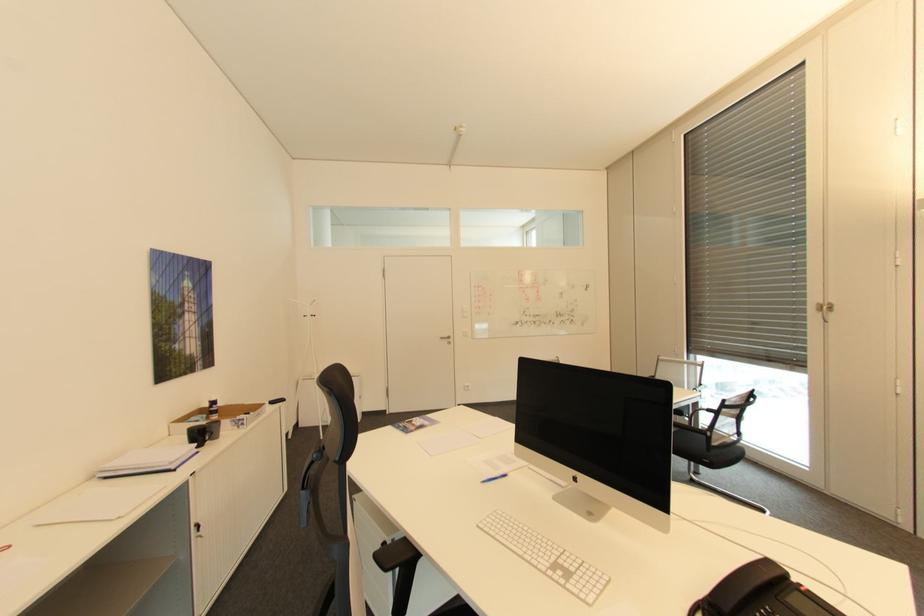
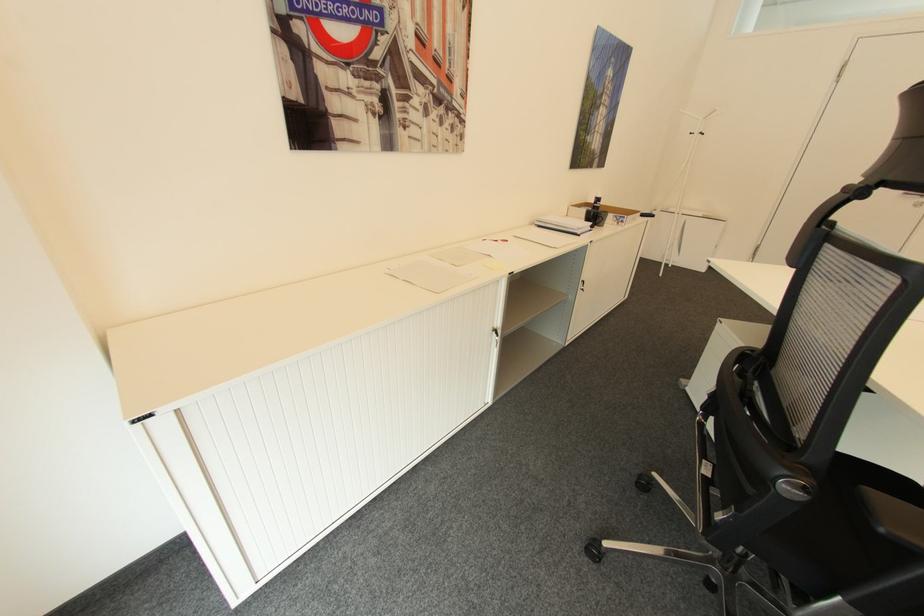
Based on the continuous images, in which direction is the camera rotating?

The camera rotated toward left-down.